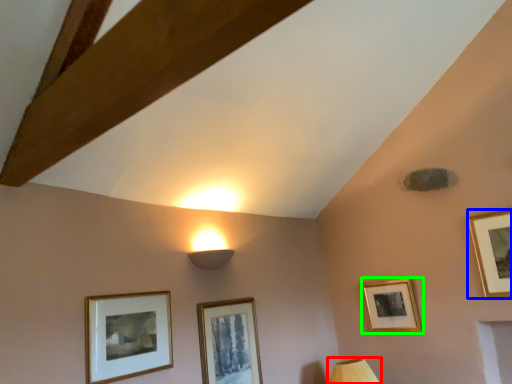
Question: Based on their relative distances, which object is nearer to table lamp (highlighted by a red box)? Choose from picture frame (highlighted by a blue box) and picture frame (highlighted by a green box).

Choices:
 (A) picture frame
 (B) picture frame

Answer: (B)